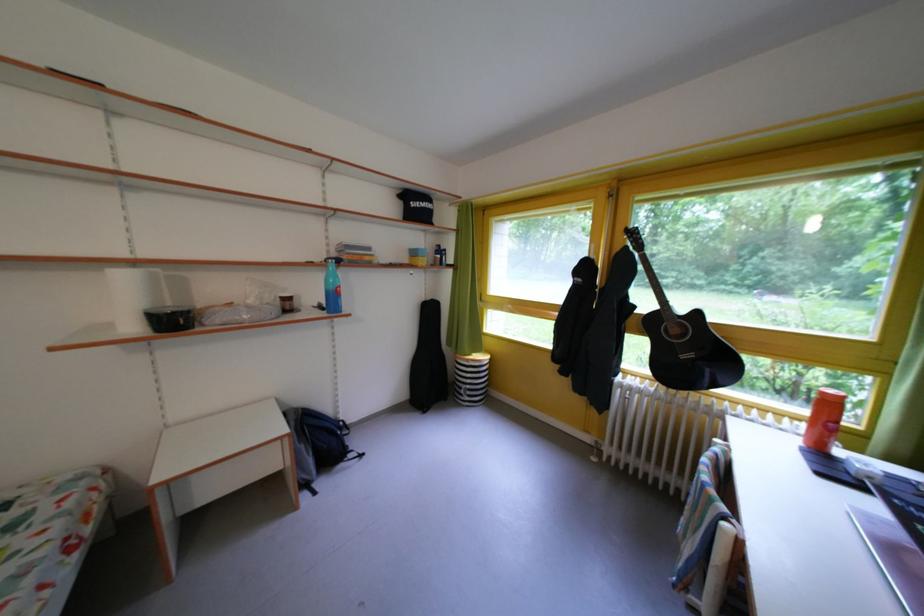
Find where to lift the blue water bottle. Please return your answer as a coordinate pair (x, y).

(332, 286)